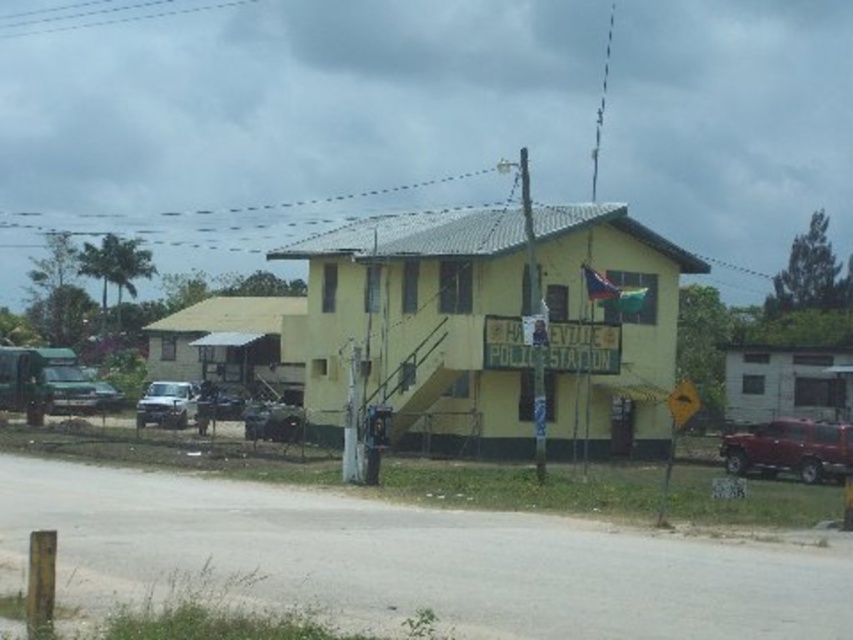
Does shiny red truck at right have a lesser height compared to metallic silver truck at center-left?

Yes, shiny red truck at right is shorter than metallic silver truck at center-left.

Can you confirm if shiny red truck at right is positioned above metallic silver truck at center-left?

No.

Is point (798, 444) more distant than point (213, 410)?

No, it is not.

Where is `shiny red truck at right`? This screenshot has width=853, height=640. shiny red truck at right is located at coordinates (790, 449).

Can you confirm if silver metallic truck at left is smaller than metallic silver truck at center-left?

No, silver metallic truck at left is not smaller than metallic silver truck at center-left.

Who is more distant from viewer, (181,419) or (206,394)?

The point (206,394) is behind.

The width and height of the screenshot is (853, 640). Identify the location of silver metallic truck at left. (166, 404).

Can you confirm if shiny red truck at right is positioned to the left of silver metallic truck at left?

In fact, shiny red truck at right is to the right of silver metallic truck at left.

Does shiny red truck at right have a smaller size compared to silver metallic truck at left?

Yes.

Identify the location of shiny red truck at right. This screenshot has width=853, height=640. (790, 449).

Image resolution: width=853 pixels, height=640 pixels. Find the location of `shiny red truck at right`. shiny red truck at right is located at coordinates (790, 449).